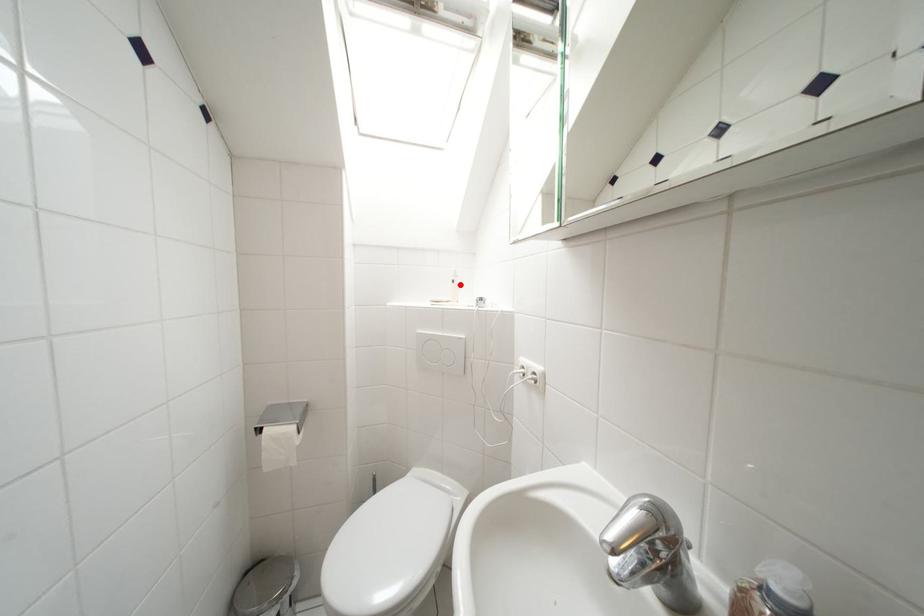
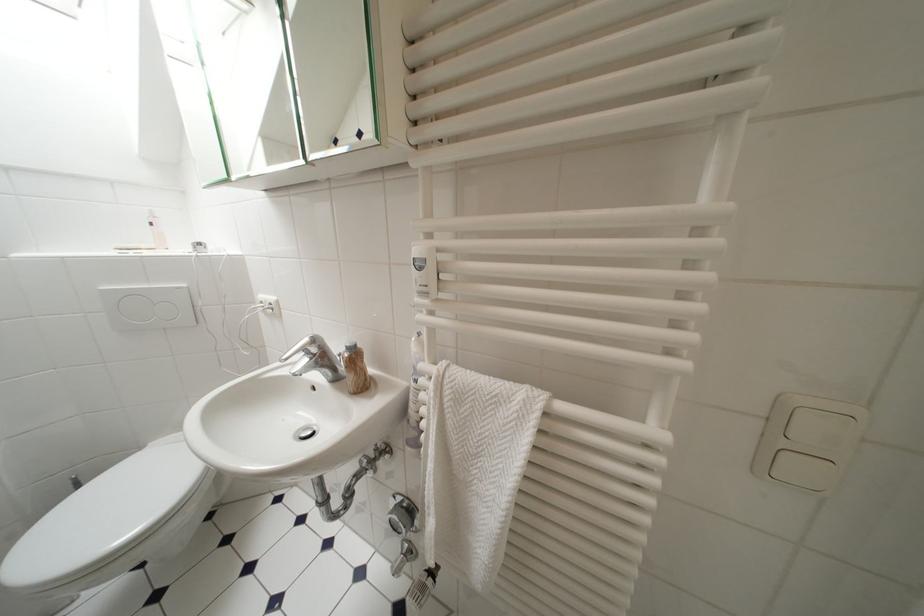
The point at the highlighted location is marked in the first image. Where is the corresponding point in the second image?

(159, 227)